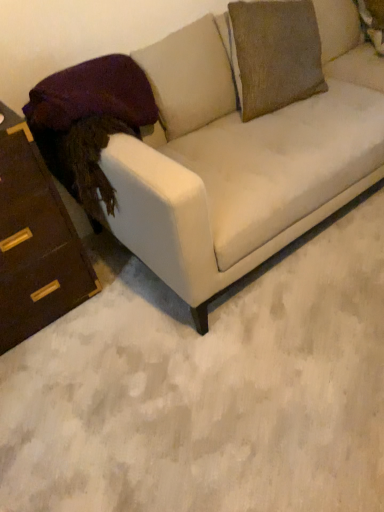
This screenshot has width=384, height=512. What are the coordinates of `free space in front of matte white couch at center` in the screenshot? It's located at tap(253, 373).